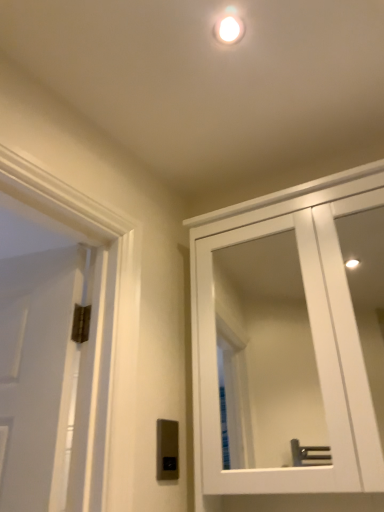
Image resolution: width=384 pixels, height=512 pixels. Find the location of `white glossy cabinet at upper right`. white glossy cabinet at upper right is located at coordinates (290, 339).

Where is `white glossy droplight at upper center`? This screenshot has height=512, width=384. white glossy droplight at upper center is located at coordinates (229, 30).

From the image's perspective, is satin silver switch at lower center above or below white glossy droplight at upper center?

Based on their image positions, satin silver switch at lower center is located beneath white glossy droplight at upper center.

Between satin silver switch at lower center and white glossy droplight at upper center, which one has more height?

satin silver switch at lower center is taller.

From a real-world perspective, does satin silver switch at lower center sit lower than white glossy droplight at upper center?

Correct, in the physical world, satin silver switch at lower center is lower than white glossy droplight at upper center.

Is point (168, 428) positioned in front of point (228, 40)?

No, it is not.

From a real-world perspective, between satin silver switch at lower center and white glossy cabinet at upper right, who is vertically higher?

white glossy cabinet at upper right.

Between satin silver switch at lower center and white glossy cabinet at upper right, which one has more height?

With more height is white glossy cabinet at upper right.

Would you say satin silver switch at lower center is inside or outside white glossy cabinet at upper right?

satin silver switch at lower center is outside white glossy cabinet at upper right.

Does satin silver switch at lower center appear on the right side of white glossy cabinet at upper right?

No.

Is white glossy cabinet at upper right inside the boundaries of satin silver switch at lower center, or outside?

white glossy cabinet at upper right is not enclosed by satin silver switch at lower center.

Considering their positions, is white glossy cabinet at upper right located in front of or behind satin silver switch at lower center?

Clearly, white glossy cabinet at upper right is in front of satin silver switch at lower center.

Are white glossy cabinet at upper right and satin silver switch at lower center located far from each other?

Yes, white glossy cabinet at upper right and satin silver switch at lower center are located far from each other.

Is white glossy cabinet at upper right at the back of white glossy droplight at upper center?

white glossy droplight at upper center does not have its back to white glossy cabinet at upper right.

Considering the relative sizes of white glossy droplight at upper center and white glossy cabinet at upper right in the image provided, is white glossy droplight at upper center thinner than white glossy cabinet at upper right?

Yes.

Which is behind, point (224, 29) or point (288, 276)?

The point (288, 276) is farther from the camera.

Is white glossy droplight at upper center positioned behind white glossy cabinet at upper right?

Yes, white glossy droplight at upper center is further from the camera.

Considering the relative sizes of white glossy cabinet at upper right and white glossy droplight at upper center in the image provided, is white glossy cabinet at upper right smaller than white glossy droplight at upper center?

No.

Is point (276, 454) closer or farther from the camera than point (227, 21)?

Point (276, 454) is positioned farther from the camera compared to point (227, 21).

Is white glossy cabinet at upper right thinner than white glossy droplight at upper center?

Incorrect, the width of white glossy cabinet at upper right is not less than that of white glossy droplight at upper center.

In the image, is white glossy cabinet at upper right positioned in front of or behind white glossy droplight at upper center?

white glossy cabinet at upper right is in front of white glossy droplight at upper center.

Where is `droplight above the satin silver switch at lower center (from a real-world perspective)`? droplight above the satin silver switch at lower center (from a real-world perspective) is located at coordinates (229, 30).

Can you see white glossy droplight at upper center touching satin silver switch at lower center?

No, white glossy droplight at upper center is not beside satin silver switch at lower center.

Considering the relative sizes of white glossy droplight at upper center and satin silver switch at lower center in the image provided, is white glossy droplight at upper center shorter than satin silver switch at lower center?

Yes, white glossy droplight at upper center is shorter than satin silver switch at lower center.

In the image, is white glossy droplight at upper center on the left side or the right side of satin silver switch at lower center?

Clearly, white glossy droplight at upper center is on the right of satin silver switch at lower center in the image.

I want to click on droplight located above the satin silver switch at lower center (from the image's perspective), so click(229, 30).

Where is `cabinetry lying on the right of satin silver switch at lower center`? The image size is (384, 512). cabinetry lying on the right of satin silver switch at lower center is located at coordinates (290, 339).

From the image, which object appears to be farther from white glossy cabinet at upper right, white glossy droplight at upper center or satin silver switch at lower center?

Among the two, white glossy droplight at upper center is located further to white glossy cabinet at upper right.

From the image, which object appears to be nearer to white glossy cabinet at upper right, satin silver switch at lower center or white glossy droplight at upper center?

satin silver switch at lower center is positioned closer to the anchor white glossy cabinet at upper right.

When comparing their distances from white glossy droplight at upper center, does satin silver switch at lower center or white glossy cabinet at upper right seem further?

white glossy cabinet at upper right is further to white glossy droplight at upper center.

Estimate the real-world distances between objects in this image. Which object is closer to white glossy droplight at upper center, white glossy cabinet at upper right or satin silver switch at lower center?

satin silver switch at lower center.

When comparing their distances from satin silver switch at lower center, does white glossy droplight at upper center or white glossy cabinet at upper right seem closer?

Among the two, white glossy droplight at upper center is located nearer to satin silver switch at lower center.

When comparing their distances from satin silver switch at lower center, does white glossy cabinet at upper right or white glossy droplight at upper center seem further?

The object further to satin silver switch at lower center is white glossy cabinet at upper right.

Where is `cabinetry between white glossy droplight at upper center and satin silver switch at lower center vertically`? cabinetry between white glossy droplight at upper center and satin silver switch at lower center vertically is located at coordinates (290, 339).